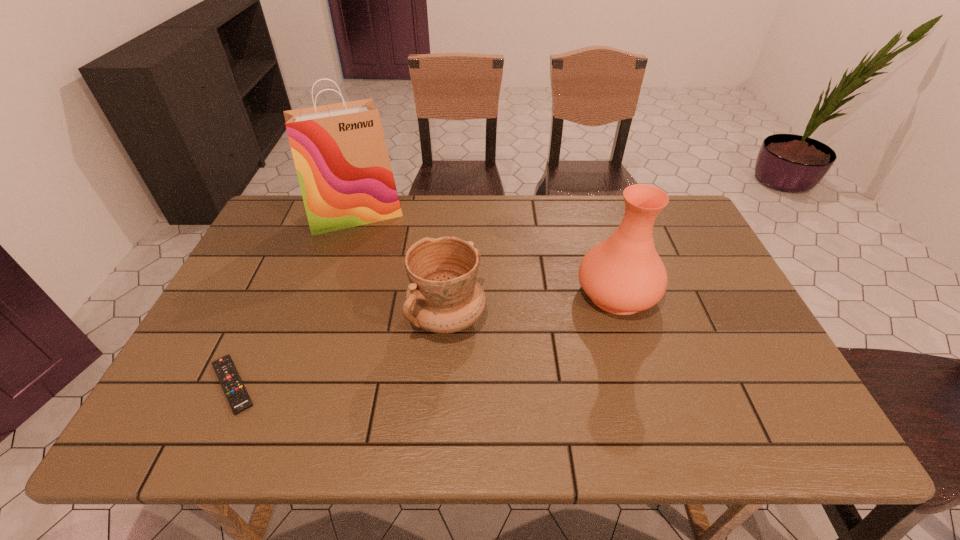
Locate an element on the screen. This screenshot has width=960, height=540. blank region between the remote control and the vase is located at coordinates coord(425,339).

This screenshot has width=960, height=540. I want to click on empty space between the farthest object and the nearest object, so click(294, 300).

The width and height of the screenshot is (960, 540). Find the location of `free space between the remote control and the farthest object`. free space between the remote control and the farthest object is located at coordinates (294, 300).

I want to click on unoccupied area between the pottery and the rightmost object, so click(532, 305).

Select which object is the closest to the third object from left to right. Please provide its 2D coordinates. Your answer should be formatted as a tuple, i.e. [(x, y)], where the tuple contains the x and y coordinates of a point satisfying the conditions above.

[(339, 150)]

Select which object is the closest to the farthest object. Please provide its 2D coordinates. Your answer should be formatted as a tuple, i.e. [(x, y)], where the tuple contains the x and y coordinates of a point satisfying the conditions above.

[(444, 296)]

This screenshot has width=960, height=540. What are the coordinates of `free space in the image that satisfies the following two spatial constraints: 1. on the front side of the rightmost object; 2. on the left side of the farthest object` in the screenshot? It's located at (328, 293).

What are the coordinates of `free space that satisfies the following two spatial constraints: 1. on the back side of the third object from left to right; 2. on the left side of the vase` in the screenshot? It's located at (448, 293).

I want to click on vacant space that satisfies the following two spatial constraints: 1. on the back side of the rightmost object; 2. on the left side of the remote control, so click(x=276, y=293).

This screenshot has height=540, width=960. I want to click on vacant space that satisfies the following two spatial constraints: 1. on the back side of the shortest object; 2. on the left side of the second object from right to left, so click(x=264, y=317).